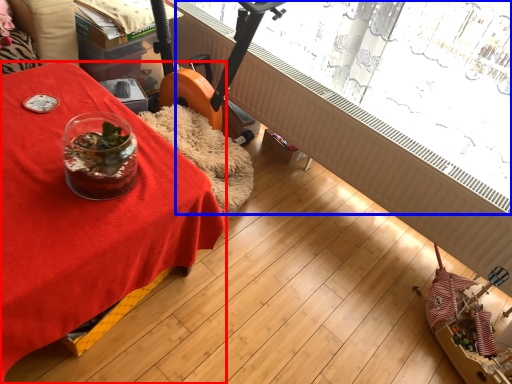
Question: Which object appears farthest to the camera in this image, table (highlighted by a red box) or bay window (highlighted by a blue box)?

Choices:
 (A) table
 (B) bay window

Answer: (B)